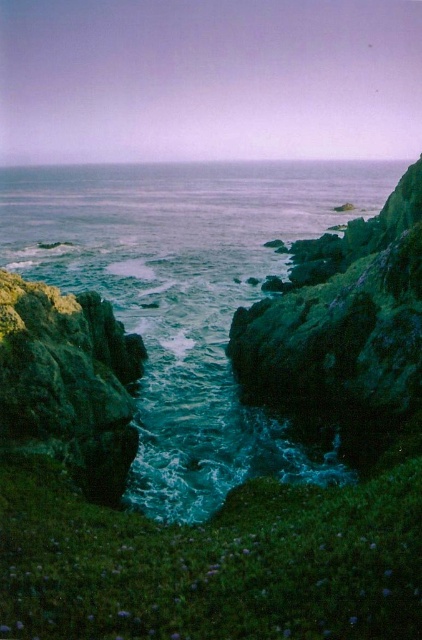
Question: Which point appears closest to the camera in this image?

Choices:
 (A) (175, 451)
 (B) (24, 360)

Answer: (B)

Question: Considering the relative positions of teal glossy water at center and green rough rock at center in the image provided, where is teal glossy water at center located with respect to green rough rock at center?

Choices:
 (A) left
 (B) right

Answer: (A)

Question: Which point is farther to the camera?

Choices:
 (A) teal glossy water at center
 (B) green rough rock at center

Answer: (A)

Question: Which point is farther to the camera?

Choices:
 (A) (354, 164)
 (B) (119, 368)

Answer: (A)

Question: Is teal glossy water at center to the right of green rough rock at center from the viewer's perspective?

Choices:
 (A) no
 (B) yes

Answer: (A)

Question: Is teal glossy water at center to the right of green rough rock at center from the viewer's perspective?

Choices:
 (A) no
 (B) yes

Answer: (A)